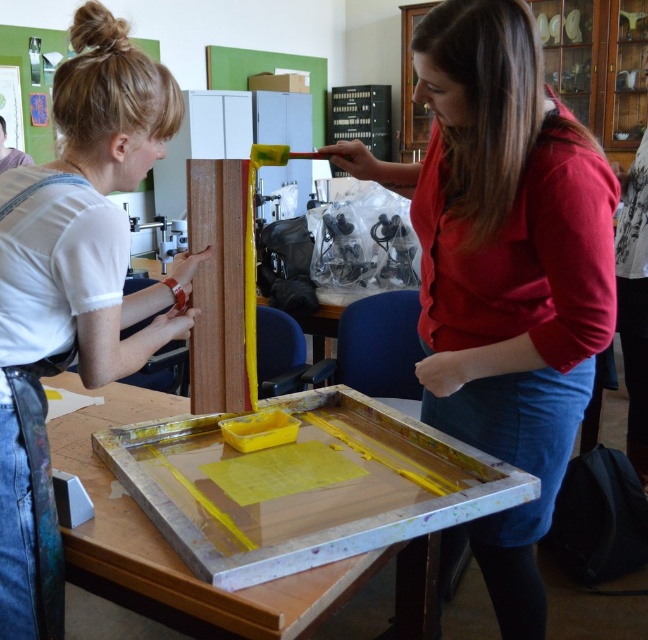
Is wooden tray at center closer to the viewer compared to wooden plank at center?

Yes, wooden tray at center is closer to the viewer.

Does wooden tray at center have a larger size compared to wooden plank at center?

Indeed, wooden tray at center has a larger size compared to wooden plank at center.

Between point (318, 588) and point (222, 182), which one is positioned behind?

The point (222, 182) is more distant.

The height and width of the screenshot is (640, 648). Find the location of `wooden tray at center`. wooden tray at center is located at coordinates (170, 545).

Which is in front, point (89, 65) or point (246, 636)?

Positioned in front is point (246, 636).

Does white matte shirt at upper left have a greater height compared to wooden tray at center?

Yes.

Does point (179, 323) come behind point (432, 550)?

No.

This screenshot has width=648, height=640. Find the location of `white matte shirt at upper left`. white matte shirt at upper left is located at coordinates (75, 289).

How far apart are matte red blouse at center and wooden tray at center?

They are 17.74 inches apart.

Does point (511, 284) lie in front of point (128, 516)?

No, it is not.

Does point (457, 353) come farther from viewer compared to point (426, 609)?

No, it is not.

I want to click on matte red blouse at center, so click(503, 268).